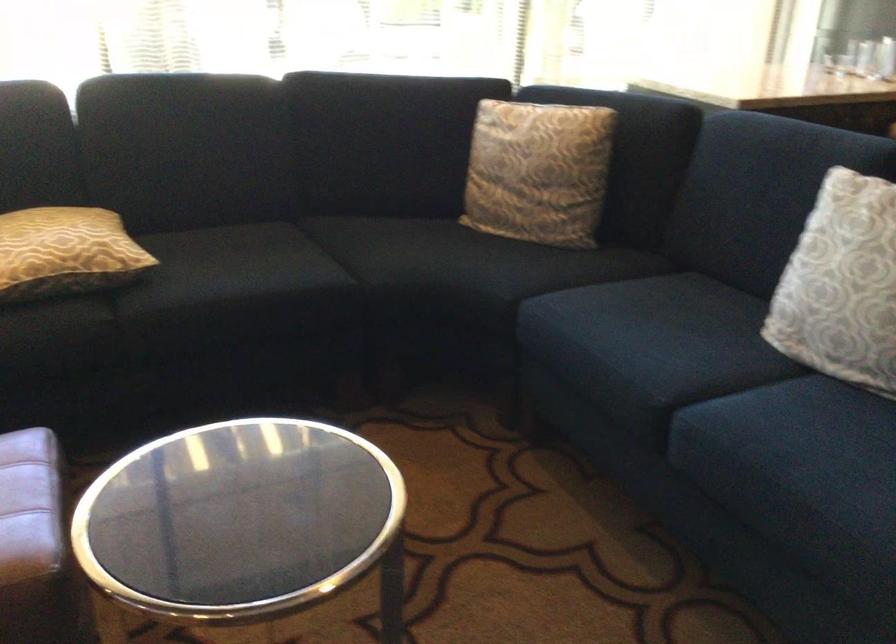
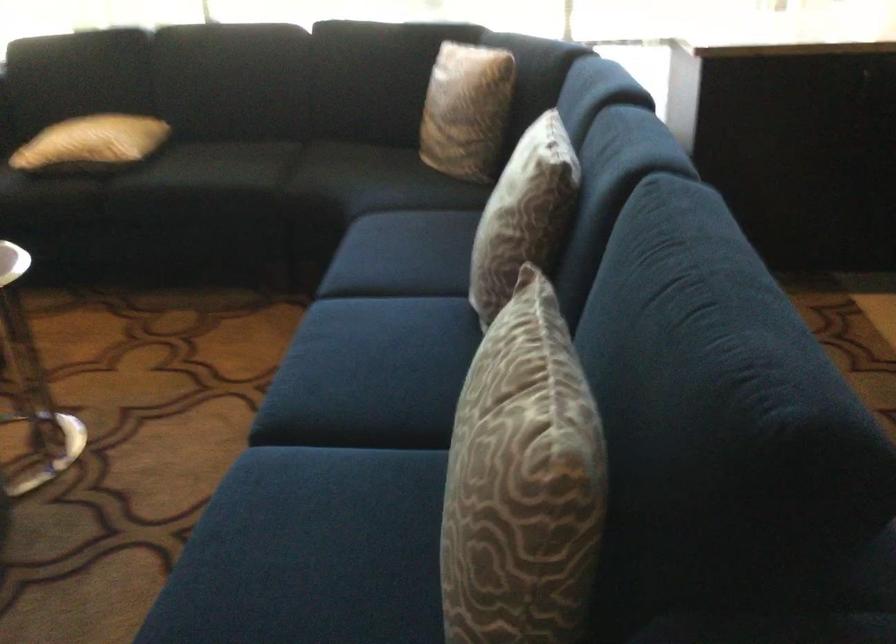
In the second image, find the point that corresponds to point (563, 172) in the first image.

(467, 109)